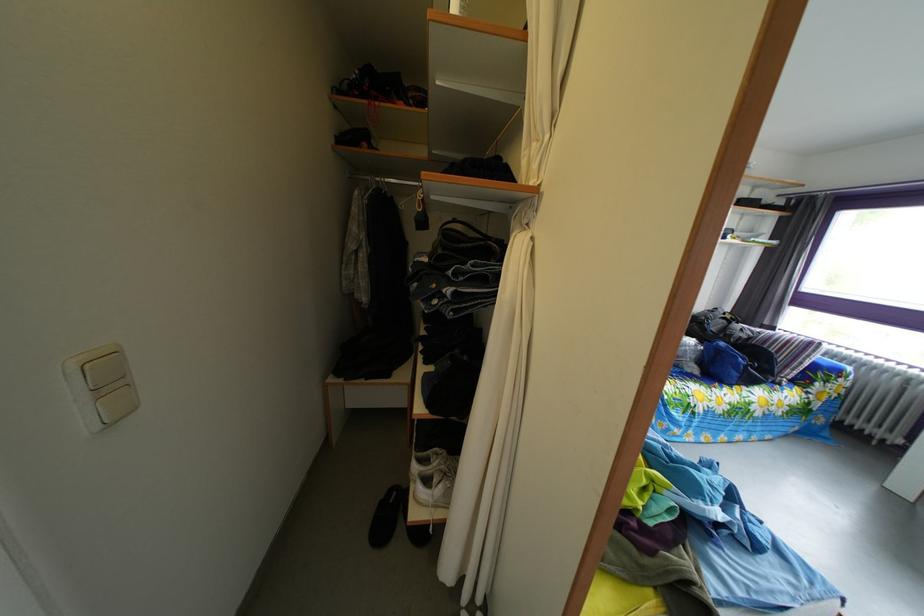
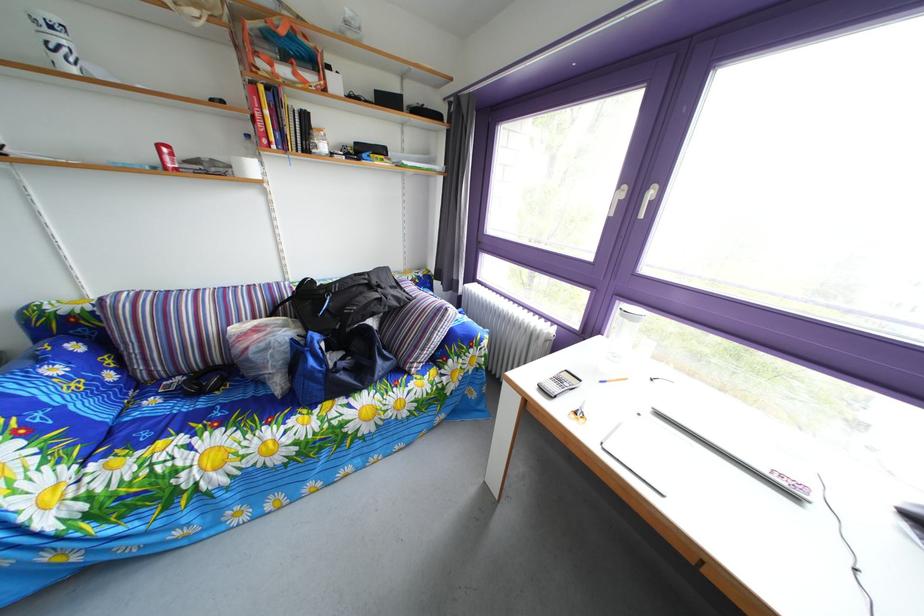
Question: The images are taken continuously from a first-person perspective. In which direction are you moving?

Choices:
 (A) Left
 (B) Right
 (C) Forward
 (D) Backward

Answer: (B)